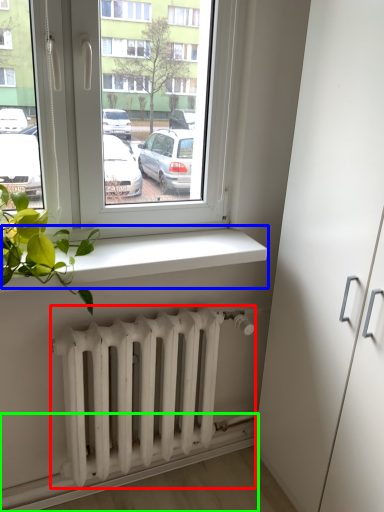
Question: Which object is positioned farthest from radiator (highlighted by a red box)? Select from window sill (highlighted by a blue box) and ledge (highlighted by a green box).

Choices:
 (A) window sill
 (B) ledge

Answer: (A)